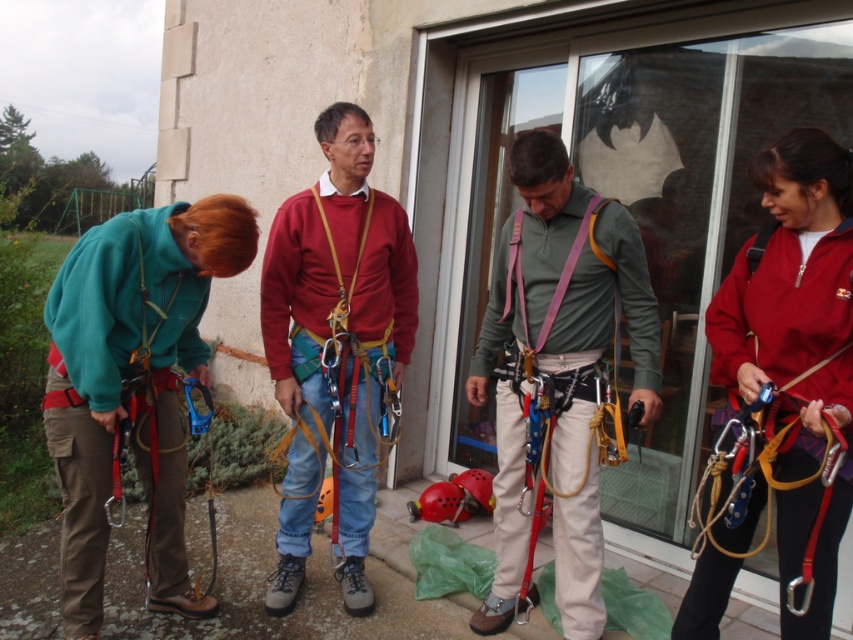
You are standing in front of the building with glass doors and see the point at coordinates (558, 372). What object is located at that point?

The point at coordinates (558, 372) corresponds to the matte green shirt at center.

You are standing in front of the building with glass doors and looking at the group of people preparing for an activity. Where is the red fleece jacket at right located in terms of its position relative to the other people?

The red fleece jacket at right is located at the rightmost position among the group since its 2D coordinates are at point (x=796, y=344), which places it furthest to the right compared to the others.

You are an observer standing in front of the building with the group. You need to quickly identify which object occupies more horizontal space in the scene. Which one is wider between the red fleece jacket at right and the purple fabric strap at center?

The red fleece jacket at right is wider than the purple fabric strap at center according to the description.